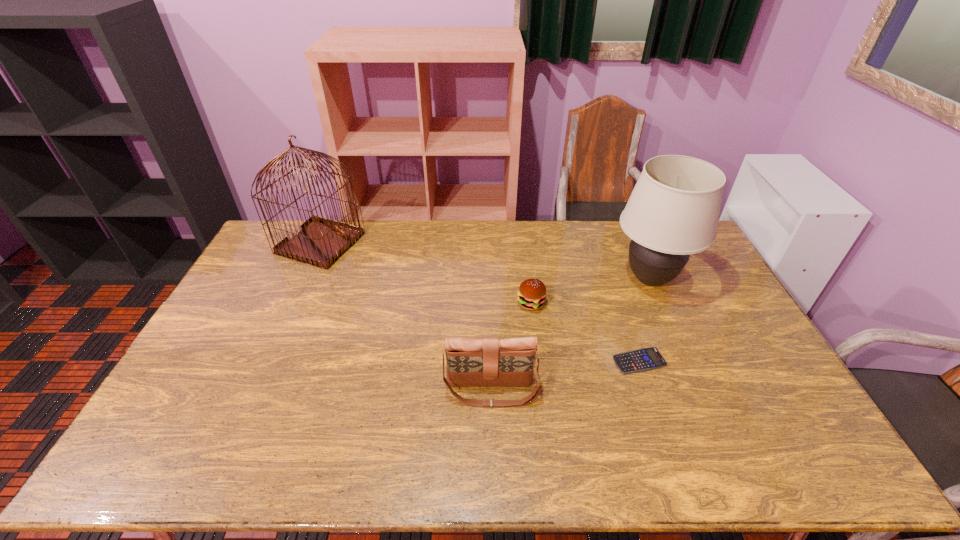
Where is `the leftmost object`? The width and height of the screenshot is (960, 540). the leftmost object is located at coordinates (321, 242).

Locate an element on the screen. The width and height of the screenshot is (960, 540). lampshade is located at coordinates (673, 211).

You are a GUI agent. You are given a task and a screenshot of the screen. Output one action in this format:
    pyautogui.click(x=<x>, y=<y>)
    Task: Click on the third shortest object
    The width and height of the screenshot is (960, 540).
    Given the screenshot: What is the action you would take?
    click(x=470, y=362)

The width and height of the screenshot is (960, 540). I want to click on hamburger, so click(531, 295).

The width and height of the screenshot is (960, 540). I want to click on the shortest object, so click(644, 359).

Where is `vacant area situated 0.250m on the front of the birdcage`? vacant area situated 0.250m on the front of the birdcage is located at coordinates (285, 321).

The image size is (960, 540). I want to click on vacant point located on the front of the lampshade, so click(x=681, y=350).

You are a GUI agent. You are given a task and a screenshot of the screen. Output one action in this format:
    pyautogui.click(x=<x>, y=<y>)
    Task: Click on the free space located 0.160m on the front-facing side of the third tallest object
    The width and height of the screenshot is (960, 540).
    Given the screenshot: What is the action you would take?
    pyautogui.click(x=493, y=469)

Image resolution: width=960 pixels, height=540 pixels. What are the coordinates of `vacant space located 0.180m on the front of the hamburger` in the screenshot? It's located at (538, 359).

Identify the location of vacant space located on the back of the calculator. (626, 321).